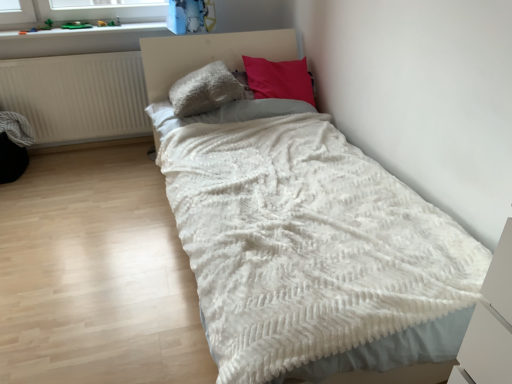
Question: Is the position of white fluffy blanket at center less distant than that of white matte radiator at left?

Choices:
 (A) yes
 (B) no

Answer: (A)

Question: Can you confirm if white fluffy blanket at center is shorter than white matte radiator at left?

Choices:
 (A) no
 (B) yes

Answer: (A)

Question: Does white fluffy blanket at center turn towards white matte radiator at left?

Choices:
 (A) yes
 (B) no

Answer: (B)

Question: Does white fluffy blanket at center have a lesser width compared to white matte radiator at left?

Choices:
 (A) yes
 (B) no

Answer: (B)

Question: Is white fluffy blanket at center positioned far away from white matte radiator at left?

Choices:
 (A) no
 (B) yes

Answer: (A)

Question: Visually, is fluffy gray pillow at center, the first pillow from the left, positioned to the left or to the right of white matte radiator at left?

Choices:
 (A) left
 (B) right

Answer: (B)

Question: Is fluffy gray pillow at center, positioned as the second pillow in right-to-left order, in front of or behind white matte radiator at left in the image?

Choices:
 (A) front
 (B) behind

Answer: (A)

Question: Is point (190, 79) positioned closer to the camera than point (143, 132)?

Choices:
 (A) closer
 (B) farther

Answer: (A)

Question: From a real-world perspective, is fluffy gray pillow at center, positioned as the second pillow in right-to-left order, above or below white matte radiator at left?

Choices:
 (A) above
 (B) below

Answer: (A)

Question: From the image's perspective, is white matte radiator at left above or below smooth plastic toys at upper left?

Choices:
 (A) above
 (B) below

Answer: (B)

Question: Is point (3, 64) closer or farther from the camera than point (60, 34)?

Choices:
 (A) farther
 (B) closer

Answer: (B)

Question: Considering the positions of white matte radiator at left and smooth plastic toys at upper left in the image, is white matte radiator at left bigger or smaller than smooth plastic toys at upper left?

Choices:
 (A) big
 (B) small

Answer: (A)

Question: In terms of width, does white matte radiator at left look wider or thinner when compared to smooth plastic toys at upper left?

Choices:
 (A) wide
 (B) thin

Answer: (B)

Question: Considering their positions, is velvet-like pink pillow at upper center, which ranks as the first pillow in right-to-left order, located in front of or behind fluffy gray pillow at center, the first pillow from the left?

Choices:
 (A) front
 (B) behind

Answer: (B)

Question: From a real-world perspective, is velvet-like pink pillow at upper center, which ranks as the first pillow in right-to-left order, positioned above or below fluffy gray pillow at center, positioned as the second pillow in right-to-left order?

Choices:
 (A) below
 (B) above

Answer: (A)